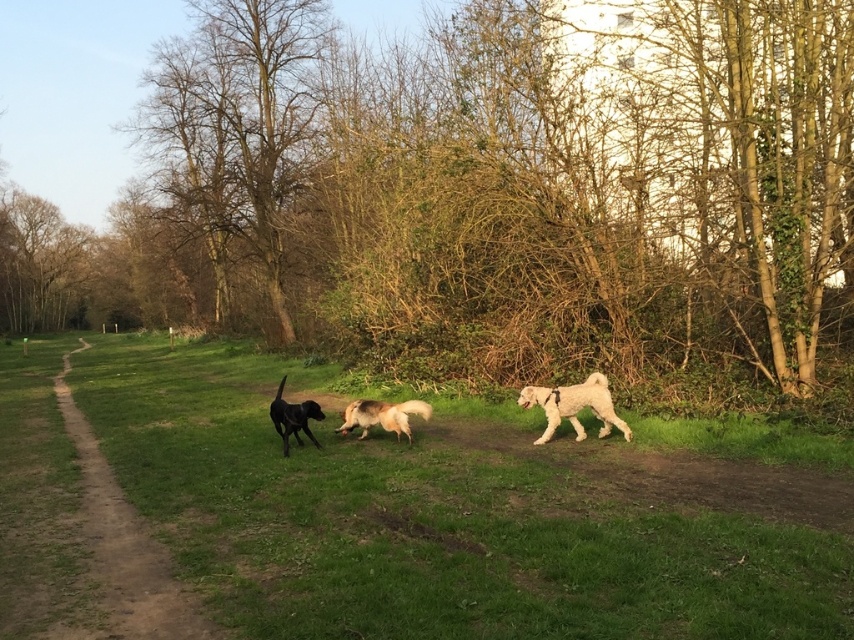
You are a photographer standing on the grassy path in the park. You want to take a photo of the shiny black dog at center and the brown leafless tree at center. Which object will appear larger in the photo?

The brown leafless tree at center will appear larger in the photo because it is much taller than the shiny black dog at center.

You are a photographer standing on the grassy path in the park. You want to take a photo of the shiny black dog at center and the brown leafless tree at center. Which object is wider when viewed from your current position?

The brown leafless tree at center is wider than the shiny black dog at center.

You are standing at the point labeled point (44, 630) and want to walk towards the point labeled point (301, 104). Which direction should you face to walk directly towards it?

Since point (44, 630) is closer to the viewer than point (301, 104), you should face towards the upper left direction to walk directly towards it.